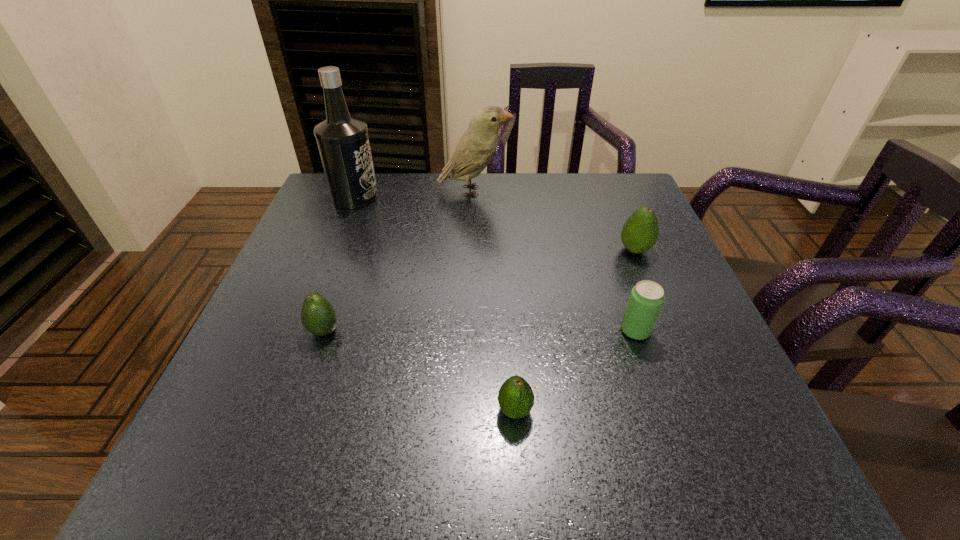
Locate an element on the screen. The height and width of the screenshot is (540, 960). free spot located on the left of the tallest avocado is located at coordinates (528, 250).

At what (x,y) coordinates should I click in order to perform the action: click on vacant space located on the back of the soda. Please return your answer as a coordinate pair (x, y). This screenshot has height=540, width=960. Looking at the image, I should click on (596, 215).

Find the location of `vacant space situated on the left of the leftmost avocado`. vacant space situated on the left of the leftmost avocado is located at coordinates (271, 331).

At what (x,y) coordinates should I click in order to perform the action: click on vacant space located on the right of the nearest object. Please return your answer as a coordinate pair (x, y). Looking at the image, I should click on (601, 410).

Find the location of a particular element. liquor located at the far edge is located at coordinates (343, 142).

Find the location of a particular element. bird located in the far edge section of the desktop is located at coordinates (477, 146).

At what (x,y) coordinates should I click in order to perform the action: click on liquor located at the left edge. Please return your answer as a coordinate pair (x, y). The height and width of the screenshot is (540, 960). Looking at the image, I should click on (343, 142).

Where is `avocado situated at the left edge`? The width and height of the screenshot is (960, 540). avocado situated at the left edge is located at coordinates (318, 316).

The height and width of the screenshot is (540, 960). I want to click on avocado that is at the right edge, so click(640, 232).

This screenshot has width=960, height=540. What are the coordinates of `soda that is at the right edge` in the screenshot? It's located at (646, 299).